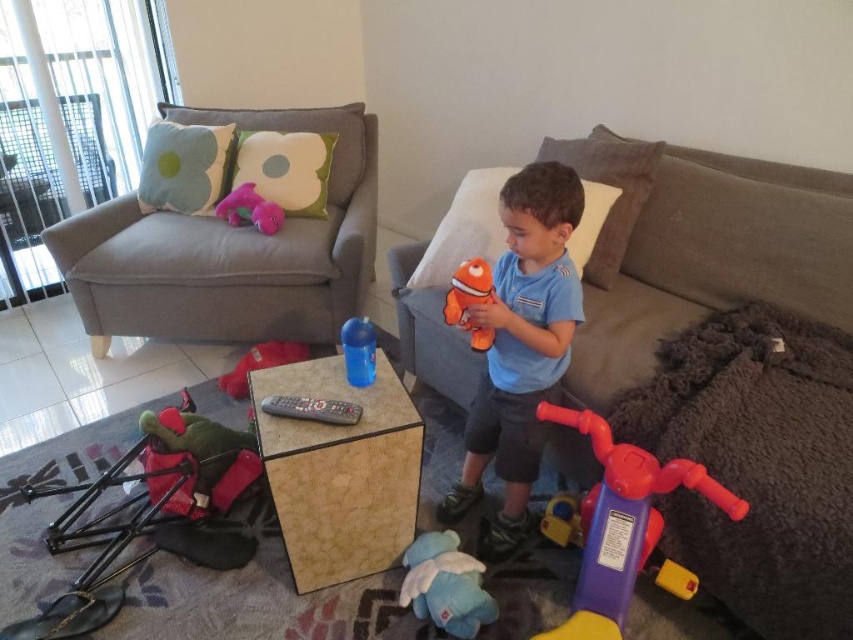
Measure the distance from light gray fabric couch at upper left to blue plush toy at lower center.

light gray fabric couch at upper left is 4.49 feet away from blue plush toy at lower center.

Which is more to the left, light gray fabric couch at upper left or blue plush toy at lower center?

From the viewer's perspective, light gray fabric couch at upper left appears more on the left side.

Who is more distant from viewer, (107,221) or (407,596)?

The point (107,221) is behind.

Find the location of a particular element. light gray fabric couch at upper left is located at coordinates (230, 250).

Is soft gray couch at center above orange plush toy at center?

Indeed, soft gray couch at center is positioned over orange plush toy at center.

Based on the photo, can you confirm if soft gray couch at center is positioned below orange plush toy at center?

Incorrect, soft gray couch at center is not positioned below orange plush toy at center.

Is point (787, 323) in front of point (489, 298)?

No, (787, 323) is behind (489, 298).

The height and width of the screenshot is (640, 853). Find the location of `soft gray couch at center`. soft gray couch at center is located at coordinates (709, 330).

What do you see at coordinates (196, 458) in the screenshot? I see `green plush monkey at lower left` at bounding box center [196, 458].

Does point (163, 410) lie in front of point (260, 401)?

No, (163, 410) is behind (260, 401).

Is point (218, 448) in front of point (344, 404)?

No.

Identify the location of green plush monkey at lower left. This screenshot has width=853, height=640. (196, 458).